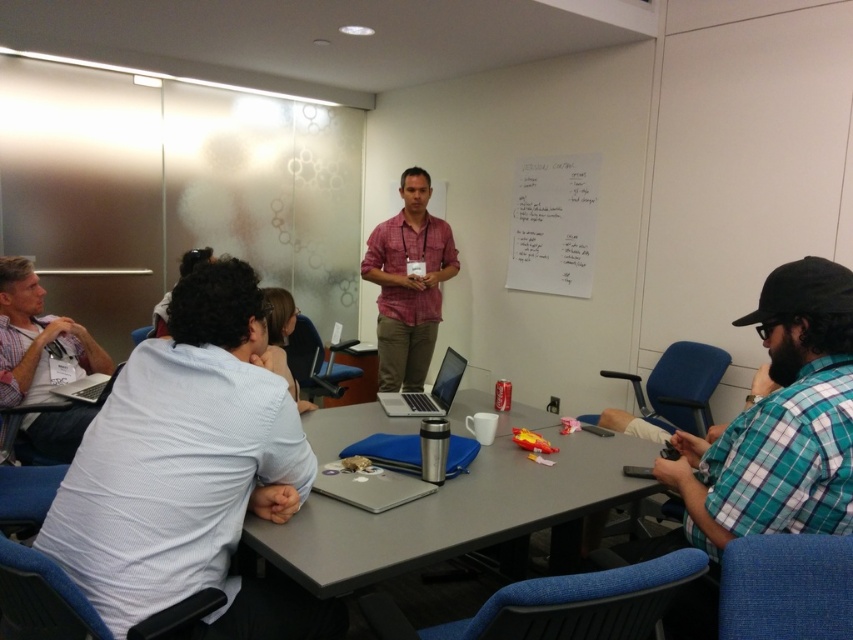
Question: Is matte white shirt at left thinner than silver metallic laptop at center?

Choices:
 (A) no
 (B) yes

Answer: (A)

Question: Estimate the real-world distances between objects in this image. Which object is closer to the gray matte table at center?

Choices:
 (A) white textured shirt at lower left
 (B) matte white shirt at left
 (C) silver metallic laptop at center
 (D) matte pink shirt at center

Answer: (A)

Question: From the image, what is the correct spatial relationship of white textured shirt at lower left in relation to gray matte table at center?

Choices:
 (A) below
 (B) above

Answer: (B)

Question: Observing the image, what is the correct spatial positioning of matte pink shirt at center in reference to matte white shirt at left?

Choices:
 (A) left
 (B) right

Answer: (B)

Question: Estimate the real-world distances between objects in this image. Which object is farther from the gray matte table at center?

Choices:
 (A) silver metallic laptop at center
 (B) white textured shirt at lower left
 (C) matte pink shirt at center
 (D) matte white shirt at left

Answer: (C)

Question: Which of the following is the farthest from the observer?

Choices:
 (A) (294, 406)
 (B) (399, 404)

Answer: (B)